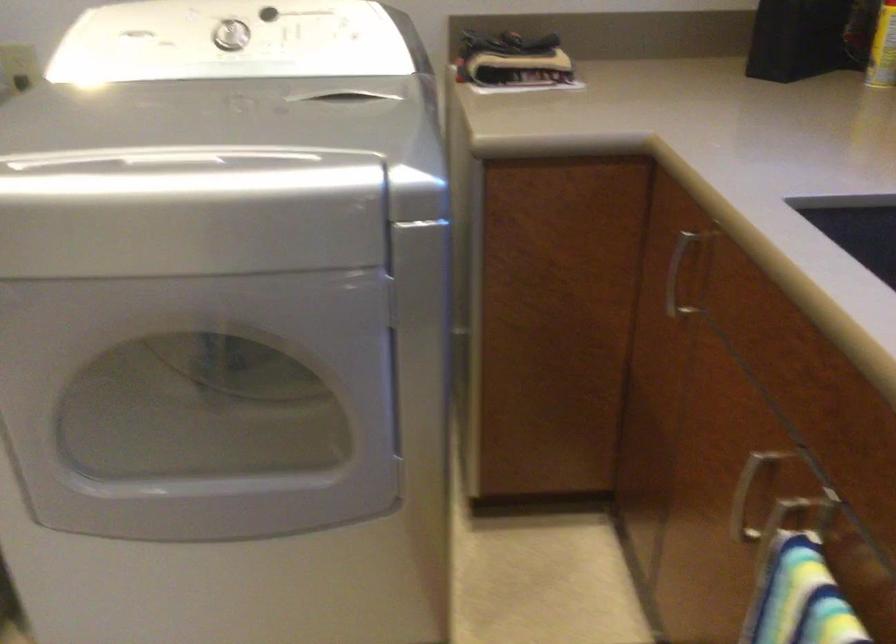
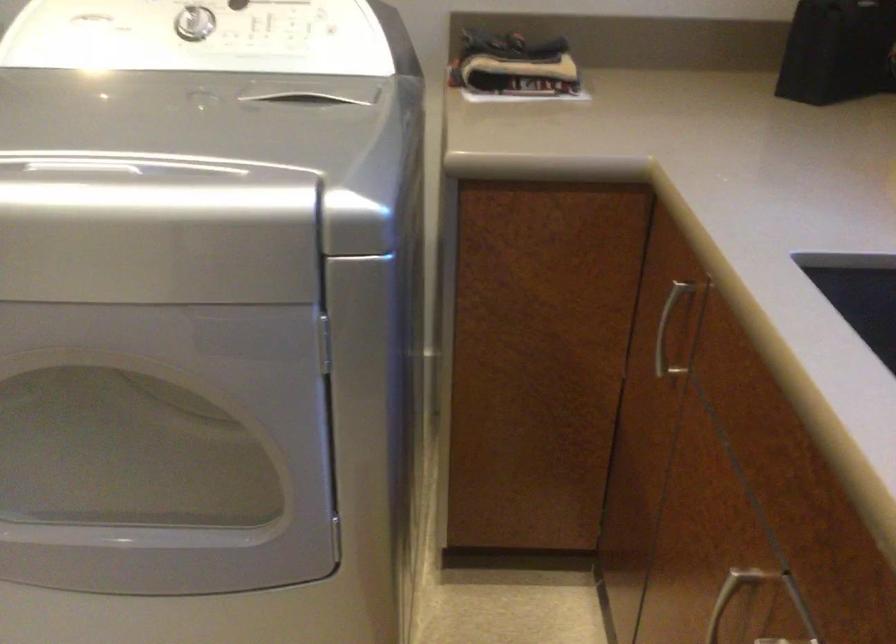
The images are taken continuously from a first-person perspective. In which direction are you moving?

The cameraman walked toward right, forward.